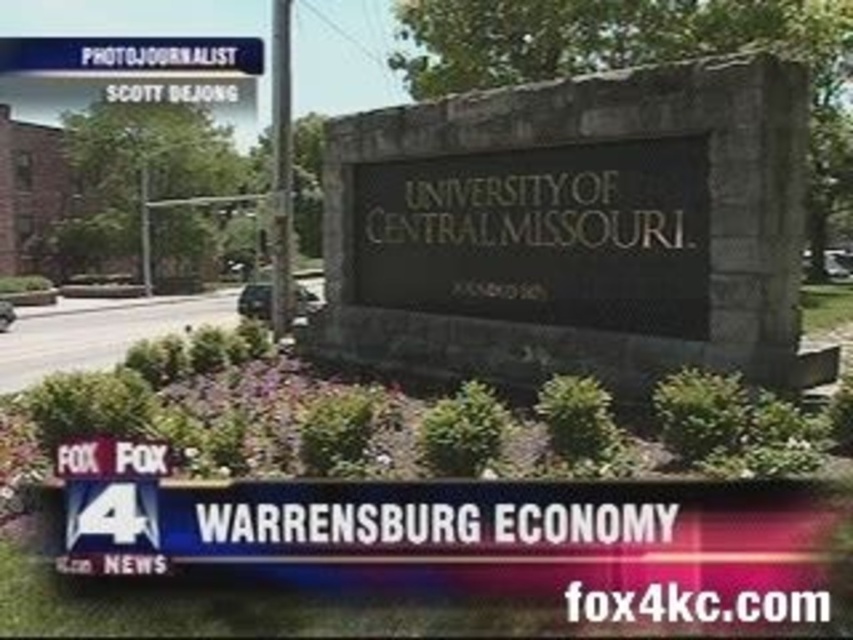
Question: Observing the image, what is the correct spatial positioning of black stone sign at center in reference to metallic pole at center?

Choices:
 (A) right
 (B) left

Answer: (B)

Question: Is black stone sign at center closer to the viewer compared to metallic pole at center?

Choices:
 (A) yes
 (B) no

Answer: (B)

Question: Is black stone sign at center positioned in front of metallic pole at center?

Choices:
 (A) no
 (B) yes

Answer: (A)

Question: Which point is farther from the camera taking this photo?

Choices:
 (A) (216, 52)
 (B) (276, 332)

Answer: (A)

Question: Which point appears farthest from the camera in this image?

Choices:
 (A) (277, 204)
 (B) (88, 38)

Answer: (B)

Question: Which of the following is the farthest from the observer?

Choices:
 (A) (103, 68)
 (B) (276, 141)

Answer: (A)